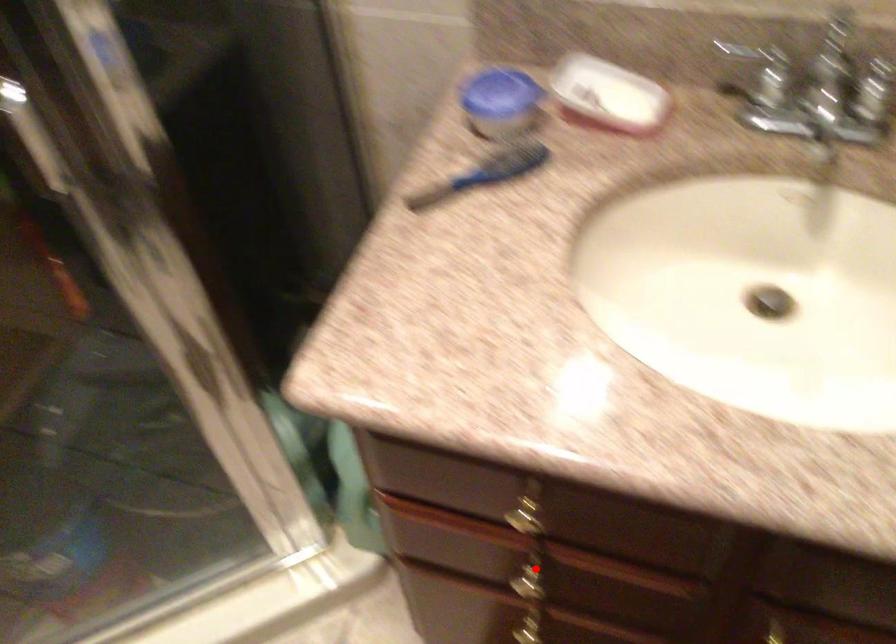
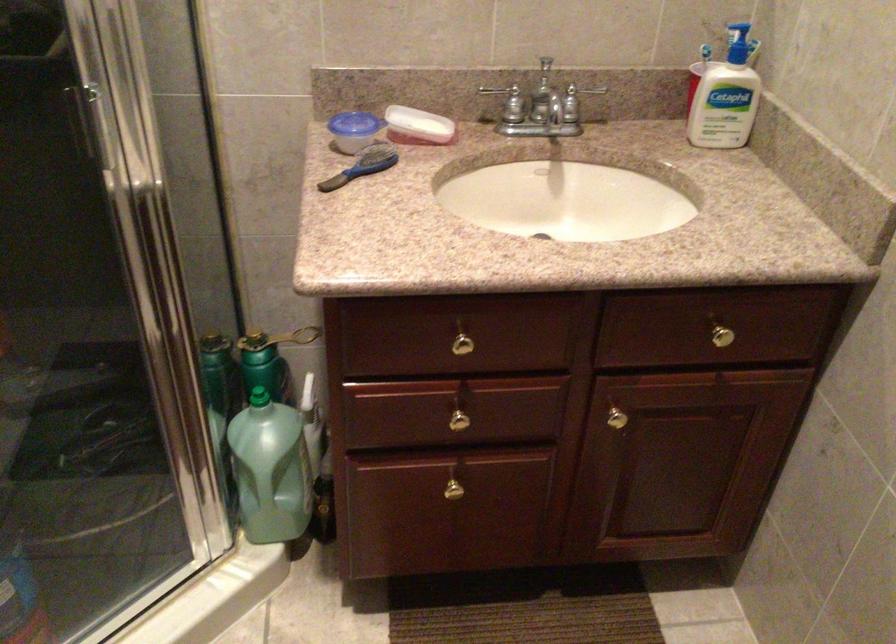
Question: I am providing you with two images of the same scene from different viewpoints. Given a red point in image1, look at the same physical point in image2. Is it:

Choices:
 (A) Closer to the viewpoint
 (B) Farther from the viewpoint

Answer: (B)